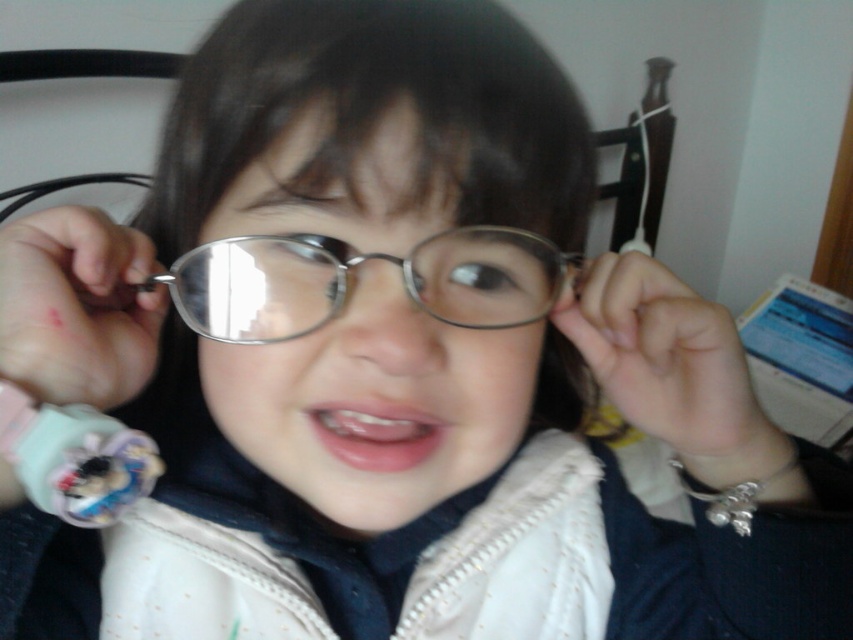
In the image, you see a child wearing metallic round glasses at center and holding a plush fabric toy at lower left. From the child perspective, which object is on the left side?

The plush fabric toy at lower left is on the left side from the child perspective because the metallic round glasses at center are to the right of the plush fabric toy at lower left.

You are a photographer adjusting the focus on your camera. You want to capture both the metallic reflective glasses at center and the metallic round glasses at center in sharp detail. Given that your camera can only focus on objects within a 1 inch range, will both glasses be in focus?

The distance between the metallic reflective glasses at center and metallic round glasses at center is 1.05 inches, which exceeds the camera focus range of 1 inch. Therefore, both glasses cannot be in focus simultaneously.

You are a photographer adjusting your camera to focus on two points in the image. The first point is at coordinate point (300, 136) and the second is at point (16, 448). Which point should you focus on first if you want to start with the one closer to the camera?

Point (300, 136) is closer to the viewer than point (16, 448), so you should focus on point (300, 136) first.